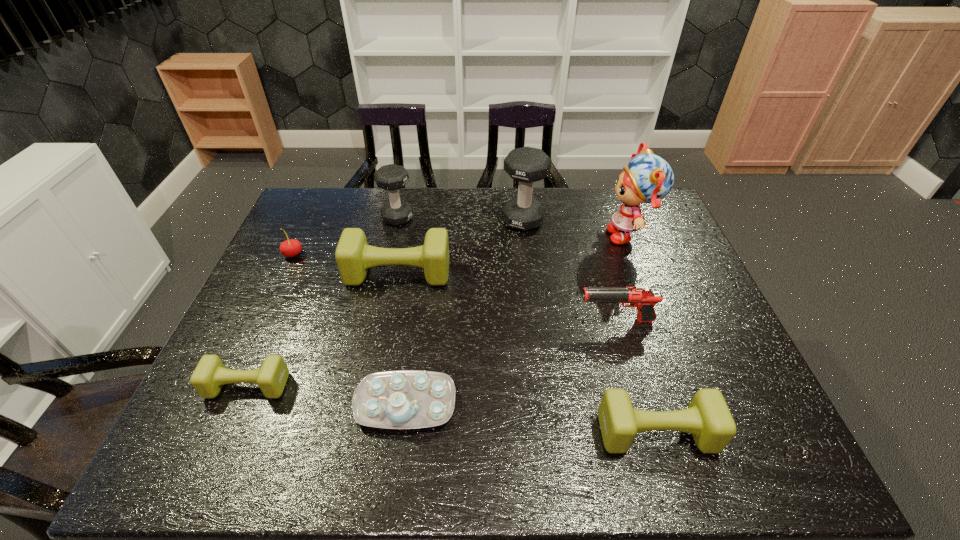
Identify the location of free space between the right gray dumbbell and the chinaware. The width and height of the screenshot is (960, 540). (465, 312).

Where is `empty location between the sixth object from left to right and the red cherry`? The height and width of the screenshot is (540, 960). empty location between the sixth object from left to right and the red cherry is located at coordinates (408, 238).

Where is `free space between the black gun and the smallest olive dumbbell`? The width and height of the screenshot is (960, 540). free space between the black gun and the smallest olive dumbbell is located at coordinates (432, 353).

Locate an element on the screen. The height and width of the screenshot is (540, 960). free space between the chinaware and the second tallest dumbbell is located at coordinates (402, 310).

Locate an element on the screen. This screenshot has width=960, height=540. vacant point located between the biggest olive dumbbell and the smaller gray dumbbell is located at coordinates (397, 246).

In order to click on free spot between the fourth farthest dumbbell and the black gun in this screenshot , I will do `click(432, 353)`.

Locate an element on the screen. Image resolution: width=960 pixels, height=540 pixels. free area in between the fourth dumbbell from left to right and the cherry is located at coordinates (408, 238).

You are a GUI agent. You are given a task and a screenshot of the screen. Output one action in this format:
    pyautogui.click(x=<x>, y=<y>)
    Task: Click on the vacant point located between the blue chinaware and the bigger gray dumbbell
    The width and height of the screenshot is (960, 540).
    Given the screenshot: What is the action you would take?
    pyautogui.click(x=465, y=312)

Where is `free space between the cherry and the doll`? This screenshot has width=960, height=540. free space between the cherry and the doll is located at coordinates (461, 245).

This screenshot has height=540, width=960. Find the location of `blank region between the left gray dumbbell and the fourth tallest dumbbell`. blank region between the left gray dumbbell and the fourth tallest dumbbell is located at coordinates (527, 326).